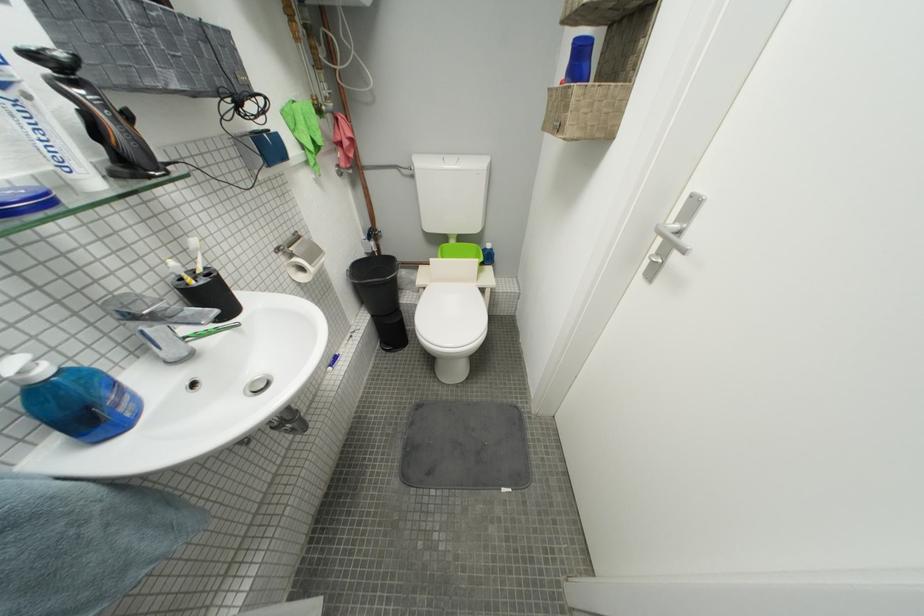
Locate an element on the screen. The height and width of the screenshot is (616, 924). toilet paper roll is located at coordinates (300, 257).